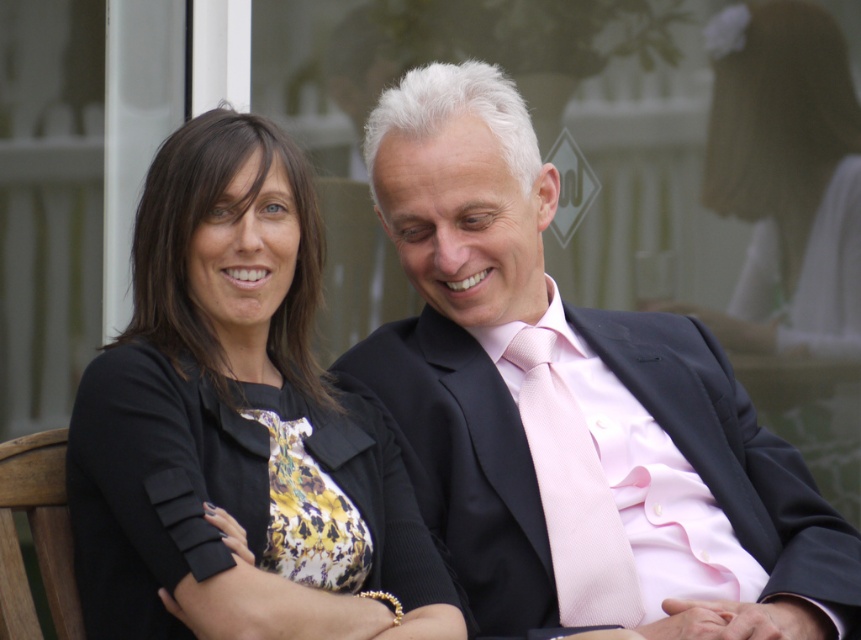
You are a photographer at a formal event and need to adjust the lighting to ensure both the matte black suit at center and the matte black blazer at center are evenly illuminated. Since both are black, how might their heights affect the lighting adjustment?

The matte black suit at center is shorter than the matte black blazer at center. Therefore, to ensure even illumination, the photographer should position the light source slightly lower for the shorter suit and higher for the blazer to account for their height difference.

You are a photographer at a formal event. You need to capture a photo of both the matte black suit at center and the matte black blazer at center. Which one is located to the left of the other?

The matte black suit at center is positioned on the left side of the matte black blazer at center.

You are standing in front of a photo of two people seated near a glass window. The woman on the left is wearing a black matte dress. The man on the right is in a formal black suit. If you want to take a closer look at the black matte dress at left without moving your head, which direction should you turn your eyes?

To look at the black matte dress at left without moving your head, you should turn your eyes to the left since the dress is positioned on the left side of the image.